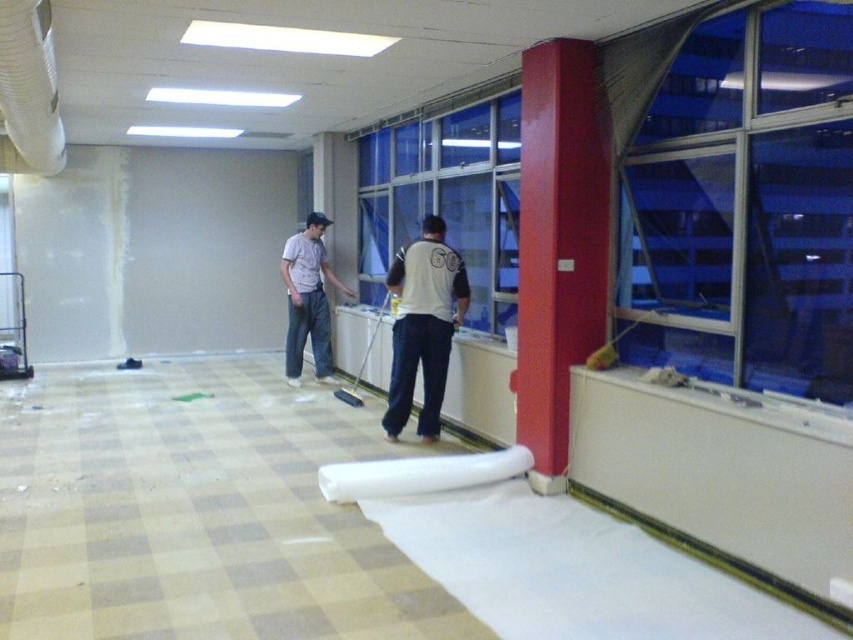
Between point (764, 236) and point (413, 282), which one is positioned behind?

The point (413, 282) is more distant.

The height and width of the screenshot is (640, 853). Describe the element at coordinates (741, 200) in the screenshot. I see `transparent glass window at upper right` at that location.

At what (x,y) coordinates should I click in order to perform the action: click on transparent glass window at upper right. Please return your answer as a coordinate pair (x, y). The width and height of the screenshot is (853, 640). Looking at the image, I should click on (741, 200).

Does transparent glass window at upper right lie in front of smooth glossy red pillar at right?

Yes.

Does point (850, 388) come farther from viewer compared to point (544, 106)?

No, it is in front of (544, 106).

Where is `transparent glass window at upper right`? transparent glass window at upper right is located at coordinates 741,200.

Is blue glass window at center further to camera compared to light gray cotton shirt at center?

No, it is in front of light gray cotton shirt at center.

Consider the image. Which is more to the left, blue glass window at center or light gray cotton shirt at center?

From the viewer's perspective, light gray cotton shirt at center appears more on the left side.

Describe the element at coordinates (448, 193) in the screenshot. I see `blue glass window at center` at that location.

Find the location of a particular element. blue glass window at center is located at coordinates (448, 193).